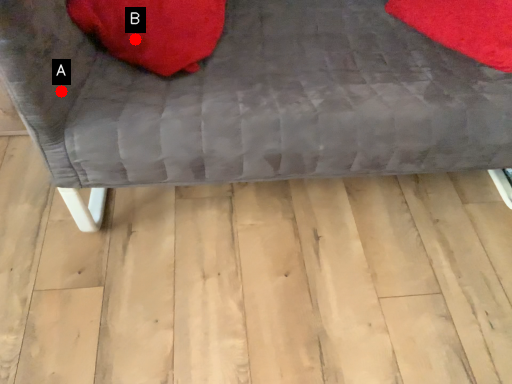
Question: Two points are circled on the image, labeled by A and B beside each circle. Which point is closer to the camera?

Choices:
 (A) A is closer
 (B) B is closer

Answer: (A)